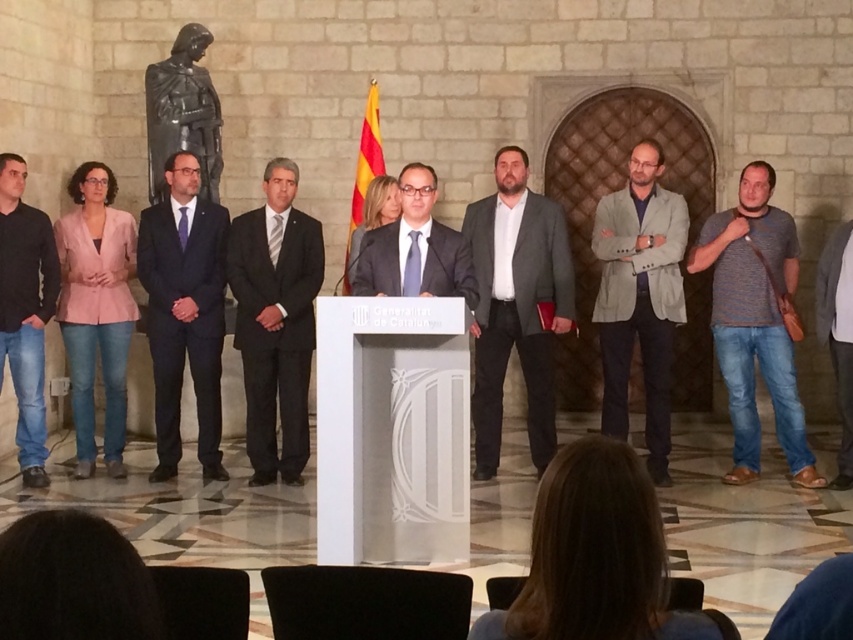
In the scene shown: Is the position of black suit at center more distant than that of jeans at left?

Yes, black suit at center is behind jeans at left.

Is black suit at center to the left of jeans at left from the viewer's perspective?

Incorrect, black suit at center is not on the left side of jeans at left.

Is point (229, 266) more distant than point (28, 314)?

Yes, it is behind point (28, 314).

You are a GUI agent. You are given a task and a screenshot of the screen. Output one action in this format:
    pyautogui.click(x=<x>, y=<y>)
    Task: Click on the black suit at center
    
    Given the screenshot: What is the action you would take?
    pyautogui.click(x=276, y=321)

Who is positioned more to the right, gray striped t-shirt at right or yellowmaterial/textureflag at center?

gray striped t-shirt at right

Does gray striped t-shirt at right appear over yellowmaterial/textureflag at center?

No, gray striped t-shirt at right is not above yellowmaterial/textureflag at center.

Does point (782, 337) come closer to viewer compared to point (367, 116)?

Yes, it is.

Locate an element on the screen. The width and height of the screenshot is (853, 640). gray striped t-shirt at right is located at coordinates (755, 321).

Between light gray textured blazer at center and bronze statue at upper left, which one appears on the left side from the viewer's perspective?

bronze statue at upper left

Where is `light gray textured blazer at center`? This screenshot has width=853, height=640. light gray textured blazer at center is located at coordinates (639, 298).

Image resolution: width=853 pixels, height=640 pixels. Identify the location of light gray textured blazer at center. (639, 298).